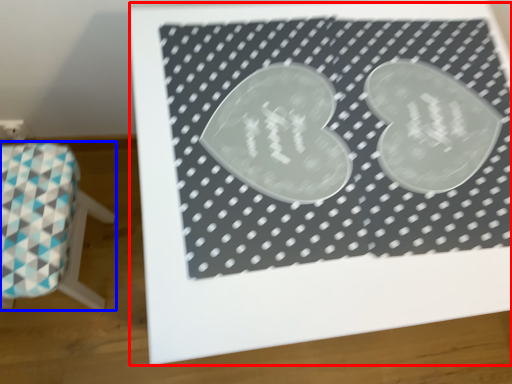
Question: Among these objects, which one is nearest to the camera, bulletin board (highlighted by a red box) or furniture (highlighted by a blue box)?

Choices:
 (A) bulletin board
 (B) furniture

Answer: (A)